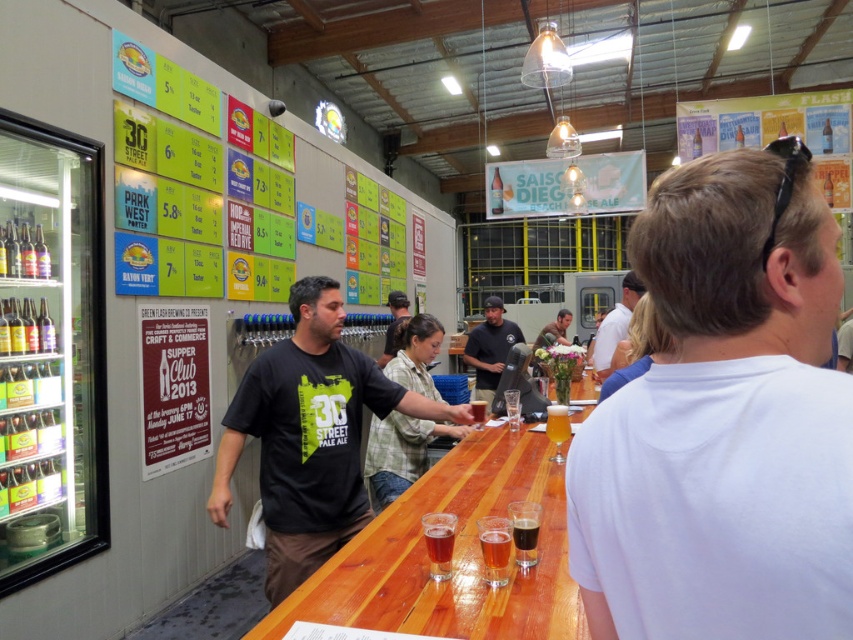
The height and width of the screenshot is (640, 853). In order to click on green plaid shirt at center in this screenshot , I will do `click(399, 452)`.

Where is `green plaid shirt at center`? green plaid shirt at center is located at coordinates (399, 452).

Consider the image. Is black t-shirt at center thinner than white cotton shirt at center?

No.

Does black t-shirt at center come behind white cotton shirt at center?

No, black t-shirt at center is in front of white cotton shirt at center.

Who is more forward, [316,554] or [612,310]?

Point [316,554] is more forward.

I want to click on black t-shirt at center, so click(x=309, y=435).

Does black t-shirt at center have a larger size compared to dark gray t-shirt at center?

Yes.

Who is higher up, black t-shirt at center or dark gray t-shirt at center?

Positioned higher is dark gray t-shirt at center.

Image resolution: width=853 pixels, height=640 pixels. I want to click on black t-shirt at center, so click(x=309, y=435).